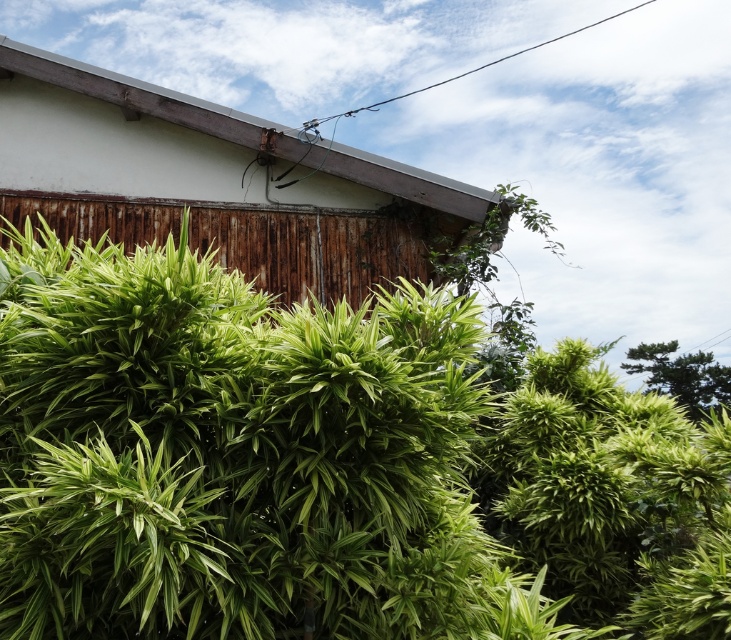
Question: Does green leafy plant at center lie behind green leafy tree at upper right?

Choices:
 (A) yes
 (B) no

Answer: (B)

Question: Which of these objects is positioned farthest from the green leafy plant at center?

Choices:
 (A) rusty wood hut at upper center
 (B) green leafy tree at upper right

Answer: (B)

Question: Does rusty wood hut at upper center appear on the right side of green leafy tree at upper right?

Choices:
 (A) yes
 (B) no

Answer: (B)

Question: Considering the real-world distances, which object is closest to the green leafy plant at center?

Choices:
 (A) green leafy tree at upper right
 (B) rusty wood hut at upper center

Answer: (B)

Question: Which point is closer to the camera?

Choices:
 (A) rusty wood hut at upper center
 (B) green leafy tree at upper right
 (C) green leafy plant at center

Answer: (C)

Question: Can you confirm if green leafy plant at center is positioned below rusty wood hut at upper center?

Choices:
 (A) yes
 (B) no

Answer: (A)